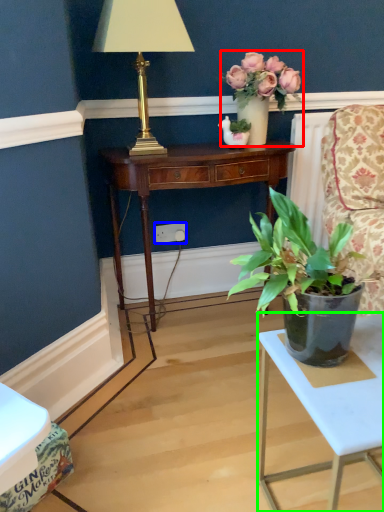
Question: Which is nearer to the houseplant (highlighted by a red box)? power outlet (highlighted by a blue box) or table (highlighted by a green box).

Choices:
 (A) power outlet
 (B) table

Answer: (A)